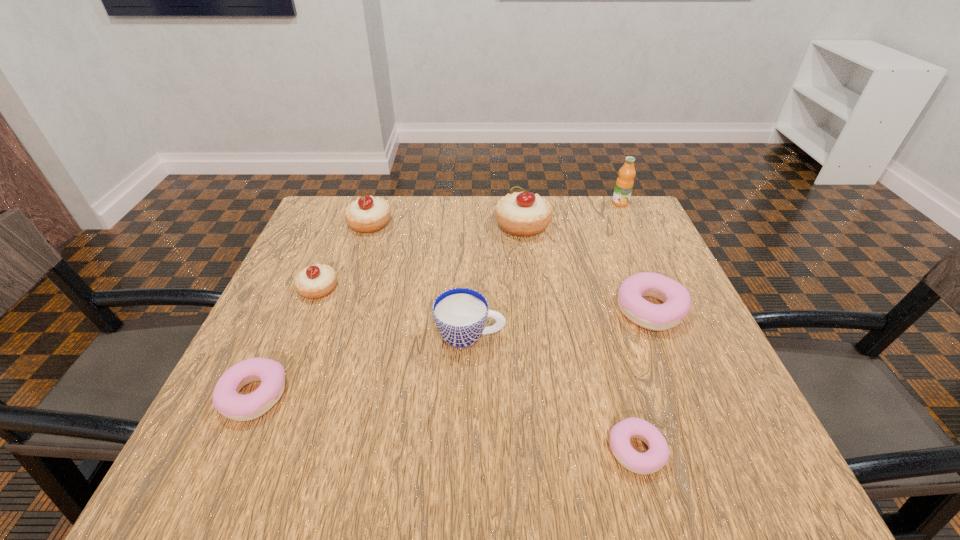
Where is `vacant area between the shortest object and the tallest object`? The image size is (960, 540). vacant area between the shortest object and the tallest object is located at coordinates (628, 327).

What are the coordinates of `free space between the blue cup and the third tallest pastry` in the screenshot? It's located at (395, 312).

Locate an element on the screen. empty space between the second smallest pink pastry and the blue cup is located at coordinates (362, 366).

The width and height of the screenshot is (960, 540). Identify the location of object that can be found as the second closest to the rightmost beige pastry. (676, 299).

Identify which object is the fifth nearest to the sixth tallest object. Please provide its 2D coordinates. Your answer should be formatted as a tuple, i.e. [(x, y)], where the tuple contains the x and y coordinates of a point satisfying the conditions above.

[(368, 214)]

At what (x,y) coordinates should I click in order to perform the action: click on pastry that stands as the closest to the farthest object. Please return your answer as a coordinate pair (x, y). The image size is (960, 540). Looking at the image, I should click on (522, 214).

You are a GUI agent. You are given a task and a screenshot of the screen. Output one action in this format:
    pyautogui.click(x=<x>, y=<y>)
    Task: Click on the pastry that is the closest to the biggest beige pastry
    The height and width of the screenshot is (540, 960).
    Given the screenshot: What is the action you would take?
    pyautogui.click(x=676, y=299)

Identify the location of beige pastry identified as the second closest to the sixth tallest object. (368, 214).

Where is `the second closest beige pastry relative to the cup`? The height and width of the screenshot is (540, 960). the second closest beige pastry relative to the cup is located at coordinates (522, 214).

Choose which pink pastry is the second nearest neighbor to the seventh tallest object. Please provide its 2D coordinates. Your answer should be formatted as a tuple, i.e. [(x, y)], where the tuple contains the x and y coordinates of a point satisfying the conditions above.

[(676, 299)]